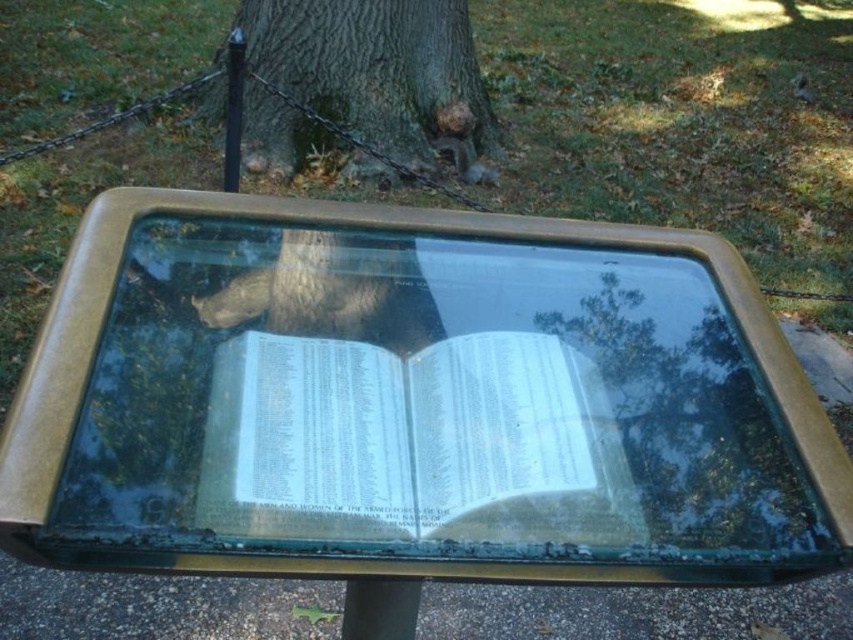
You are standing in front of the bronze plaque with a glass cover. You notice a green rough bark tree at center and a gray fur squirrel at upper center reflected in the glass. Which object is closer to you in the reflection?

The green rough bark tree at center is closer to the viewer than the gray fur squirrel at upper center in the reflection.

You are a photographer aiming to capture both the white paper book at center and the gray fur squirrel at upper center in a single shot. Given their positions, which object should you focus on first to ensure both are in frame without moving the camera?

The gray fur squirrel at upper center should be focused on first since the white paper book at center is located below it, allowing the camera to capture both by adjusting focus from the higher positioned squirrel down to the book.

You are standing in front of the bronze plaque and want to place a small gift on the green patina glass table at center and the gray fur squirrel at upper center. Which object allows you to place the gift on it?

The green patina glass table at center allows you to place the gift on it because it is a table, while the gray fur squirrel at upper center is an animal and cannot support objects.